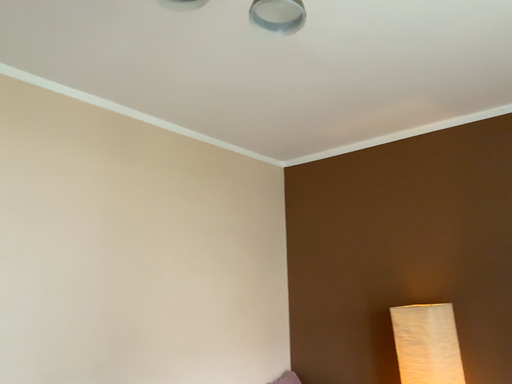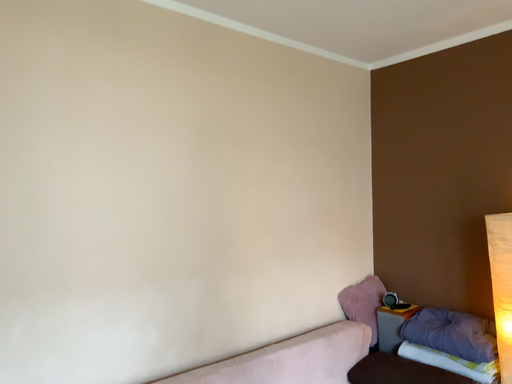
Question: How did the camera likely rotate when shooting the video?

Choices:
 (A) rotated left
 (B) rotated right

Answer: (A)